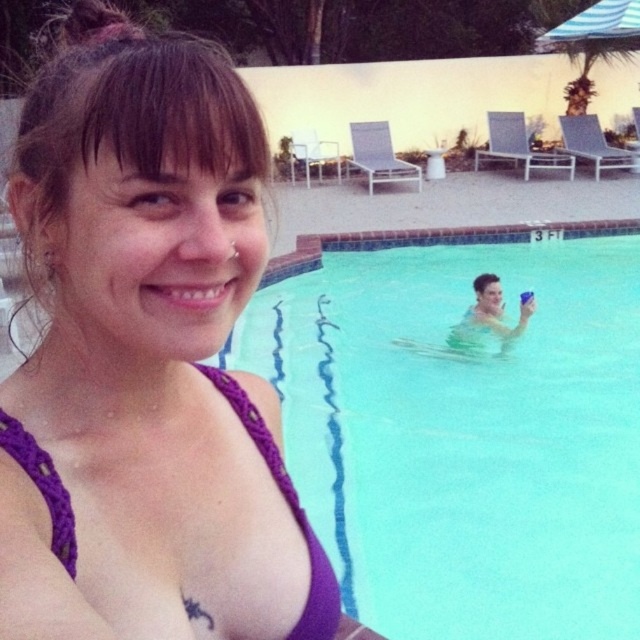
Does purple fabric bikini top at upper left have a lesser height compared to clear blue water at center?

Indeed, purple fabric bikini top at upper left has a lesser height compared to clear blue water at center.

Is purple fabric bikini top at upper left smaller than clear blue water at center?

Indeed, purple fabric bikini top at upper left has a smaller size compared to clear blue water at center.

Is point (230, 125) closer to viewer compared to point (616, 317)?

Yes, it is in front of point (616, 317).

The height and width of the screenshot is (640, 640). Identify the location of purple fabric bikini top at upper left. (147, 358).

Is purple fabric bikini top at upper left thinner than purple macrame bikini top at center?

In fact, purple fabric bikini top at upper left might be wider than purple macrame bikini top at center.

Can you confirm if purple fabric bikini top at upper left is wider than purple macrame bikini top at center?

Indeed, purple fabric bikini top at upper left has a greater width compared to purple macrame bikini top at center.

Which is in front, point (237, 458) or point (292, 628)?

Positioned in front is point (292, 628).

Identify the location of purple fabric bikini top at upper left. The image size is (640, 640). (147, 358).

Is point (349, 388) farther from camera compared to point (324, 586)?

Yes, point (349, 388) is behind point (324, 586).

Is clear blue water at center to the right of purple macrame bikini top at center from the viewer's perspective?

Correct, you'll find clear blue water at center to the right of purple macrame bikini top at center.

Find the location of a particular element. clear blue water at center is located at coordinates [x=465, y=433].